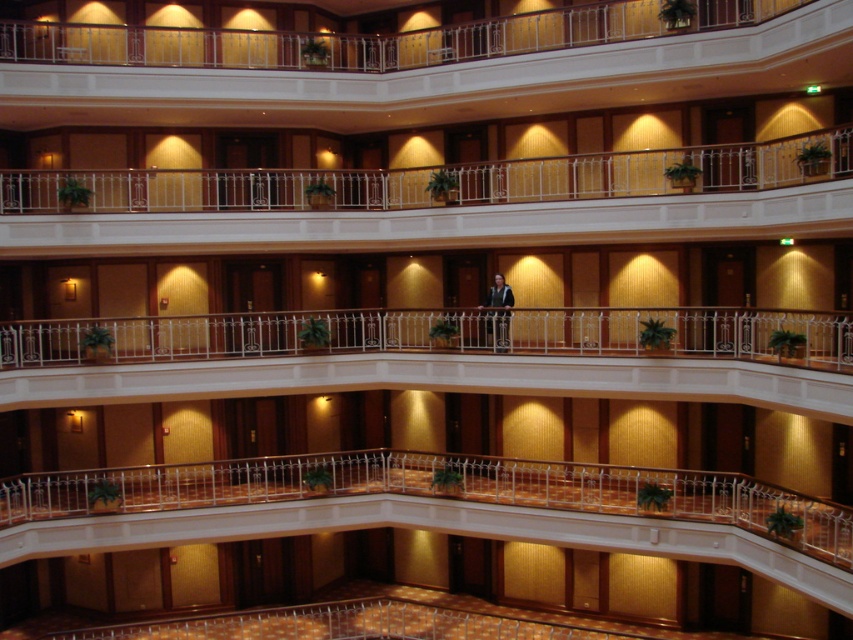
Question: Which point is closer to the camera?

Choices:
 (A) (347, 316)
 (B) (434, 166)

Answer: (B)

Question: Is white glossy railing at center below white metal railing at upper center?

Choices:
 (A) no
 (B) yes

Answer: (B)

Question: Does white glossy railing at center appear under white metal railing at upper center?

Choices:
 (A) yes
 (B) no

Answer: (A)

Question: Is white glossy railing at center thinner than white metal railing at upper center?

Choices:
 (A) yes
 (B) no

Answer: (A)

Question: Among these objects, which one is farthest from the camera?

Choices:
 (A) white glossy railing at center
 (B) white metal railing at upper center

Answer: (B)